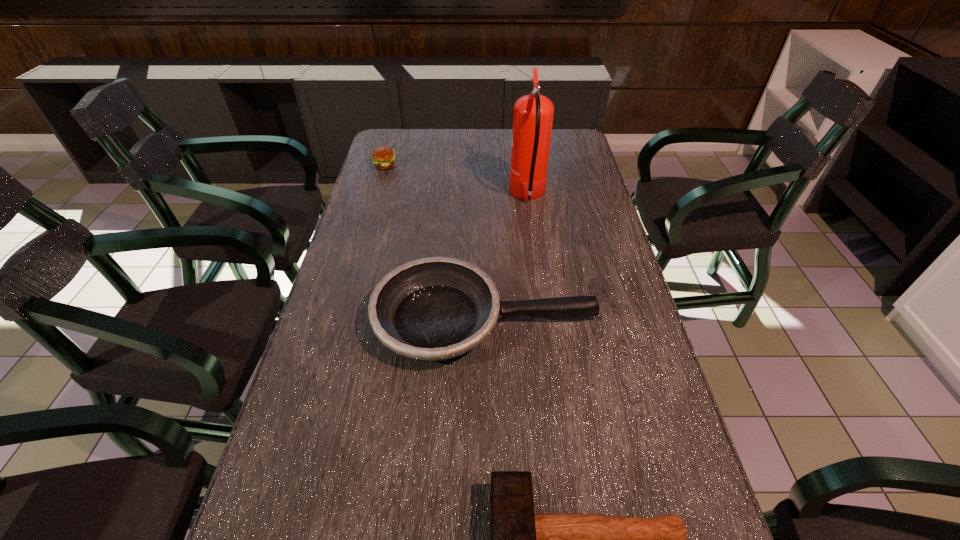
I want to click on the tallest object, so click(533, 114).

Image resolution: width=960 pixels, height=540 pixels. In order to click on fire extinguisher in this screenshot , I will do `click(533, 114)`.

Where is `frying pan`? This screenshot has height=540, width=960. frying pan is located at coordinates (433, 309).

Identify the location of hamburger. (383, 157).

Identify the location of the leftmost object. This screenshot has width=960, height=540. (383, 157).

The width and height of the screenshot is (960, 540). Find the location of `vacant area situated towards the nozzle of the fire extinguisher`. vacant area situated towards the nozzle of the fire extinguisher is located at coordinates (457, 195).

Locate an element on the screen. The width and height of the screenshot is (960, 540). free space located towards the nozzle of the fire extinguisher is located at coordinates (433, 195).

Find the location of a particular element. This screenshot has width=960, height=540. vacant space located 0.120m towards the nozzle of the fire extinguisher is located at coordinates point(472,195).

Find the location of a particular element. This screenshot has width=960, height=540. free space located on the handle side of the second nearest object is located at coordinates (637, 320).

Identify the location of free space located on the back of the hamburger. (392, 142).